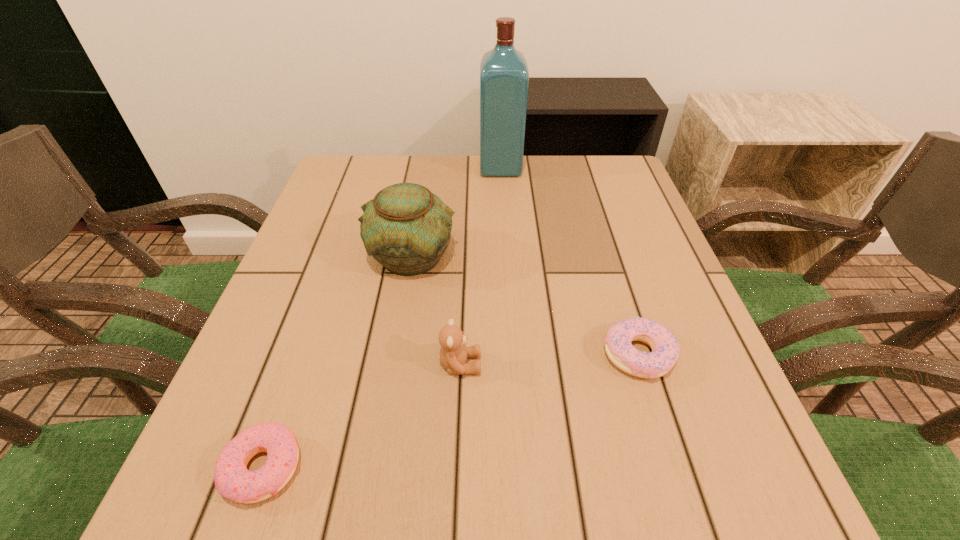
This screenshot has width=960, height=540. In order to click on free space located on the flat label side of the tallest object in this screenshot , I will do `click(371, 168)`.

At what (x,y) coordinates should I click in order to perform the action: click on vacant position located 0.380m on the flat label side of the tallest object. Please return your answer as a coordinate pair (x, y). Image resolution: width=960 pixels, height=540 pixels. Looking at the image, I should click on (342, 168).

Identify the location of vacant space located on the back of the second farthest object. (421, 201).

Where is `vacant space located on the front-facing side of the third shortest object`? vacant space located on the front-facing side of the third shortest object is located at coordinates (686, 364).

The height and width of the screenshot is (540, 960). In order to click on vacant space located on the back of the farther doughnut in this screenshot , I will do `click(598, 227)`.

Locate an element on the screen. Image resolution: width=960 pixels, height=540 pixels. vacant space located 0.260m on the back of the leftmost object is located at coordinates (321, 303).

The image size is (960, 540). What are the coordinates of `object at the far edge` in the screenshot? It's located at (504, 77).

Locate an element on the screen. The width and height of the screenshot is (960, 540). object situated at the near edge is located at coordinates (232, 479).

Locate an element on the screen. pottery that is at the left edge is located at coordinates (406, 228).

At what (x,y) coordinates should I click in order to perform the action: click on doughnut located in the left edge section of the desktop. Please return your answer as a coordinate pair (x, y). The height and width of the screenshot is (540, 960). Looking at the image, I should click on (232, 479).